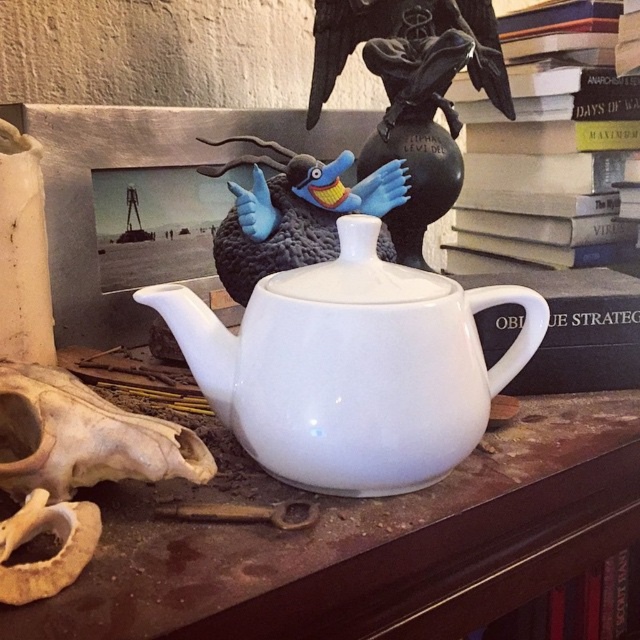
Question: Is hardcover book at upper center further to camera compared to rusty metal key at lower center?

Choices:
 (A) yes
 (B) no

Answer: (A)

Question: Which point is closer to the camera?

Choices:
 (A) bone-like skull at lower left
 (B) hardcover book at upper center
 (C) brown bone skull at lower left

Answer: (C)

Question: Does bone-like skull at lower left have a lesser width compared to black matte bird at upper center?

Choices:
 (A) no
 (B) yes

Answer: (B)

Question: Does bone-like skull at lower left have a lesser width compared to rusty metal key at lower center?

Choices:
 (A) no
 (B) yes

Answer: (A)

Question: Which object appears farthest from the camera in this image?

Choices:
 (A) rusty metal key at lower center
 (B) bone-like skull at lower left

Answer: (A)

Question: Estimate the real-world distances between objects in this image. Which object is farther from the white glossy teapot at center?

Choices:
 (A) blue plush bird at center
 (B) hardcover book at upper center
 (C) white glossy teapot at lower center
 (D) rusty metal key at lower center

Answer: (B)